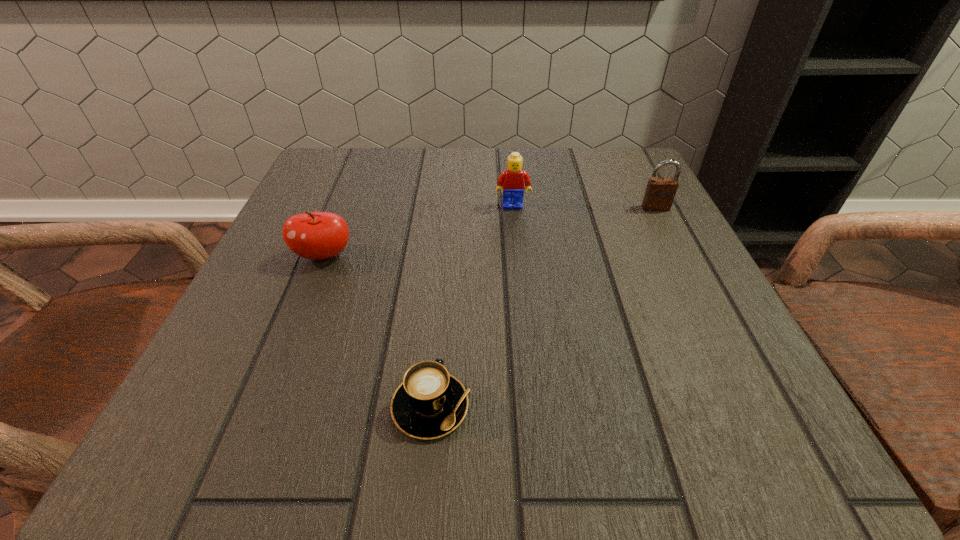
Image resolution: width=960 pixels, height=540 pixels. In order to click on free space that is in between the padlock and the Lego in this screenshot , I will do `click(584, 207)`.

This screenshot has height=540, width=960. Identify the location of object that ranks as the third closest to the third object from left to right. (430, 403).

Identify which object is the closest to the nearest object. Please provide its 2D coordinates. Your answer should be formatted as a tuple, i.e. [(x, y)], where the tuple contains the x and y coordinates of a point satisfying the conditions above.

[(311, 235)]